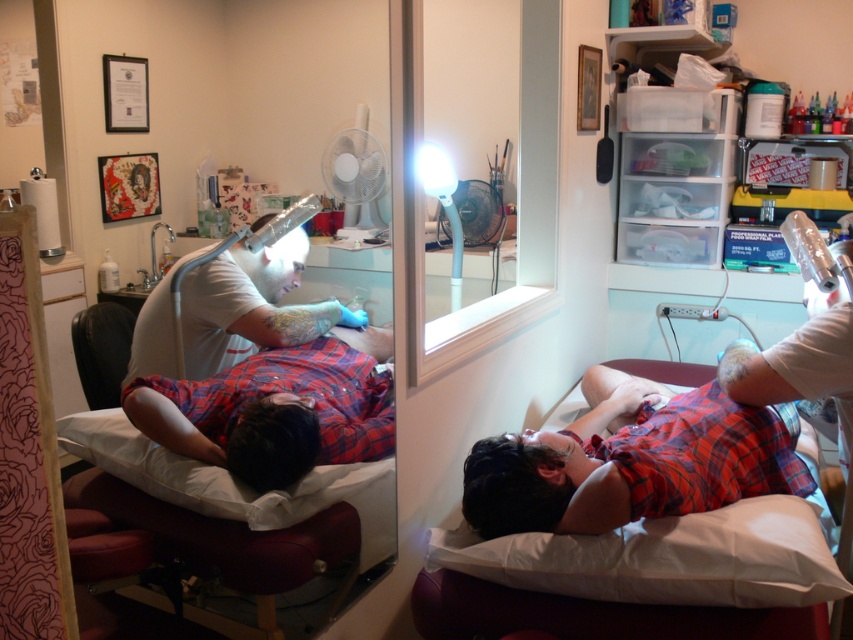
Is point (659, 502) more distant than point (828, 515)?

No, it is in front of (828, 515).

Who is taller, red plaid shirt at lower center or white fabric pillow at lower center?

With more height is red plaid shirt at lower center.

Find the location of `red plaid shirt at lower center`. red plaid shirt at lower center is located at coordinates (630, 465).

Is point (212, 404) closer to camera compared to point (184, 481)?

No, it is behind (184, 481).

The height and width of the screenshot is (640, 853). What do you see at coordinates (271, 412) in the screenshot?
I see `red plaid shirt at lower left` at bounding box center [271, 412].

At what (x,y) coordinates should I click in order to perform the action: click on red plaid shirt at lower left. Please return your answer as a coordinate pair (x, y). This screenshot has width=853, height=640. Looking at the image, I should click on (271, 412).

Is matte white lamp at upper left positioned behind red plaid shirt at lower right?

Yes, matte white lamp at upper left is behind red plaid shirt at lower right.

Who is more distant from viewer, (221, 291) or (700, 628)?

Point (221, 291)

Where is `matte white lamp at upper left`? matte white lamp at upper left is located at coordinates (248, 305).